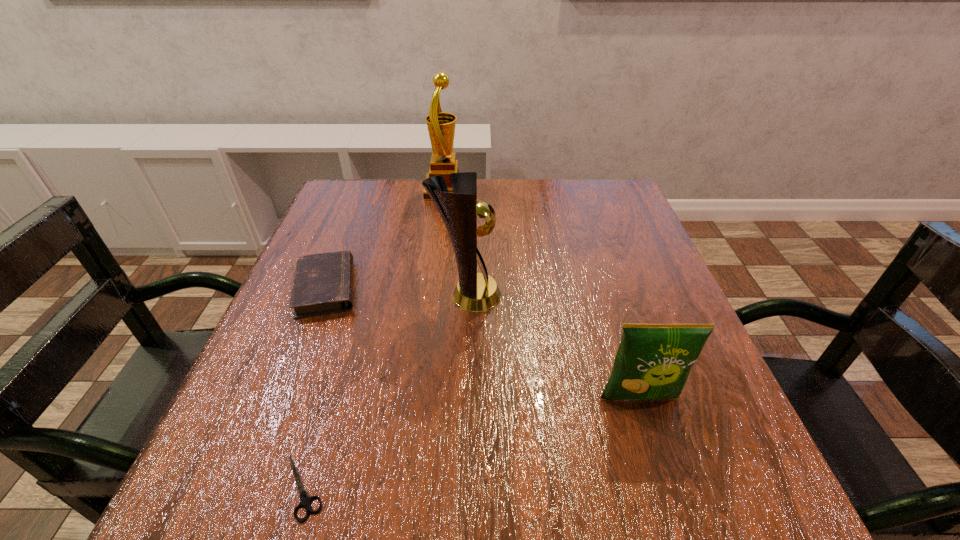
Locate an element on the screen. the farther award is located at coordinates (441, 126).

This screenshot has width=960, height=540. What are the coordinates of `the nearer award` in the screenshot? It's located at (475, 292).

Image resolution: width=960 pixels, height=540 pixels. Identify the location of the rightmost object. coord(653,361).

At what (x,y) coordinates should I click in order to perform the action: click on crisp (potato chip). Please return your answer as a coordinate pair (x, y). Looking at the image, I should click on (653, 361).

Identify the location of the second shortest object. This screenshot has height=540, width=960. 323,283.

Find the location of `shears`. shears is located at coordinates (305, 500).

Locate an element on the screen. Image resolution: width=960 pixels, height=540 pixels. the shortest object is located at coordinates (305, 500).

Image resolution: width=960 pixels, height=540 pixels. What are the coordinates of `free spot located 0.320m on the front-facing side of the farthest object` in the screenshot? It's located at (581, 190).

Find the location of a particular element. Image resolution: width=960 pixels, height=540 pixels. free space located at the front of the nearer award, where the globe is visible is located at coordinates (629, 295).

I want to click on vacant space located on the front-facing side of the crisp (potato chip), so click(x=653, y=441).